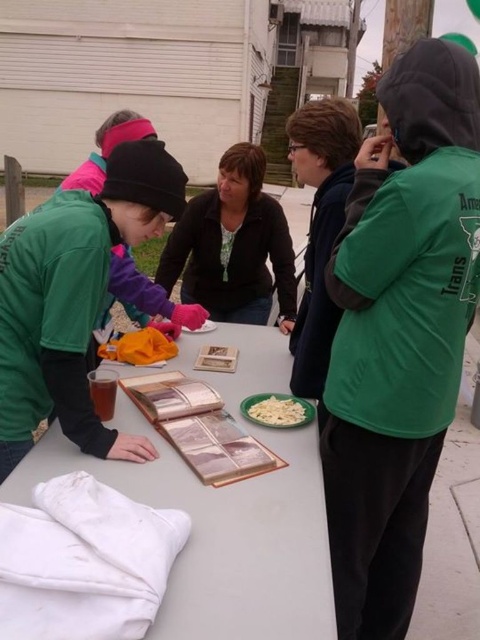
Question: Does green matte hoodie at upper right appear under white creamy pasta at center?

Choices:
 (A) no
 (B) yes

Answer: (A)

Question: Which point is farther from the camera taking this photo?

Choices:
 (A) (333, 493)
 (B) (184, 497)

Answer: (A)

Question: Is white fabric at lower left below white creamy pasta at center?

Choices:
 (A) yes
 (B) no

Answer: (A)

Question: Observing the image, what is the correct spatial positioning of green matte hoodie at upper right in reference to white creamy pasta at center?

Choices:
 (A) below
 (B) above

Answer: (B)

Question: Which point is closer to the camera?

Choices:
 (A) (457, 227)
 (B) (266, 410)
 (C) (91, 264)

Answer: (A)

Question: Which object is closer to the camera taking this photo?

Choices:
 (A) white creamy pasta at center
 (B) green matte jacket at center

Answer: (B)